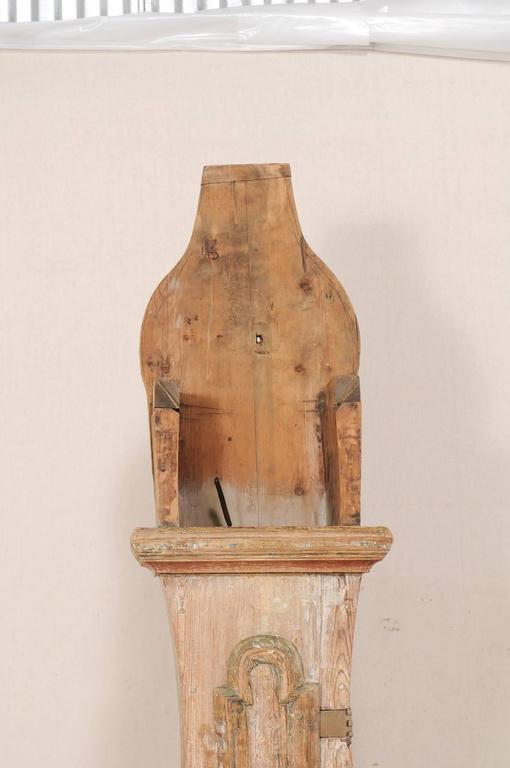
Identify the location of top of carved wood. click(242, 166).